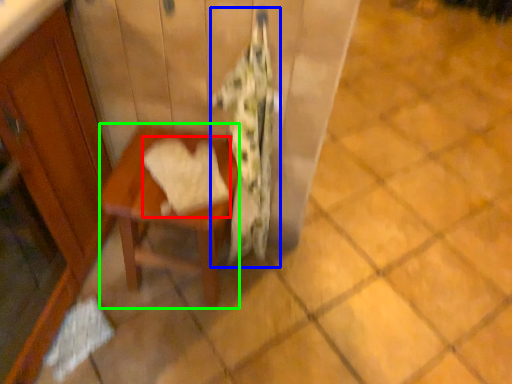
Question: Which object is the closest to the bath towel (highlighted by a red box)? Choose among these: blanket (highlighted by a blue box) or table (highlighted by a green box).

Choices:
 (A) blanket
 (B) table

Answer: (B)